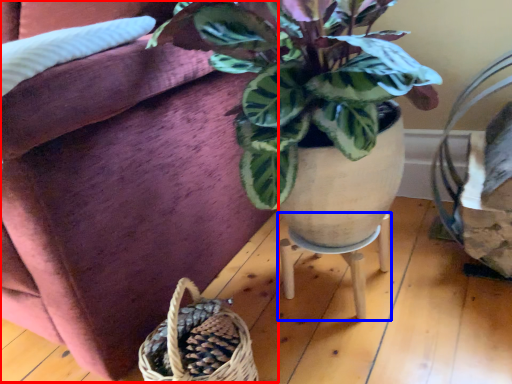
Question: Which object is further to the camera taking this photo, couch (highlighted by a red box) or table (highlighted by a blue box)?

Choices:
 (A) couch
 (B) table

Answer: (B)